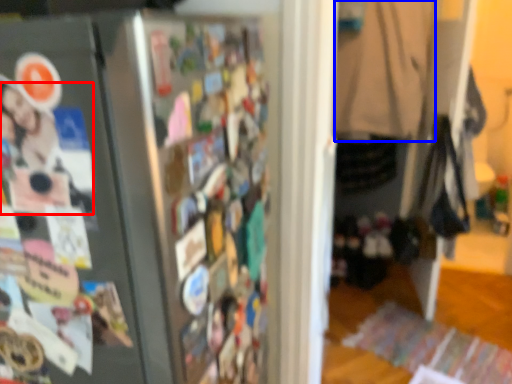
Question: Among these objects, which one is nearest to the camera, person (highlighted by a red box) or clothing (highlighted by a blue box)?

Choices:
 (A) person
 (B) clothing

Answer: (A)